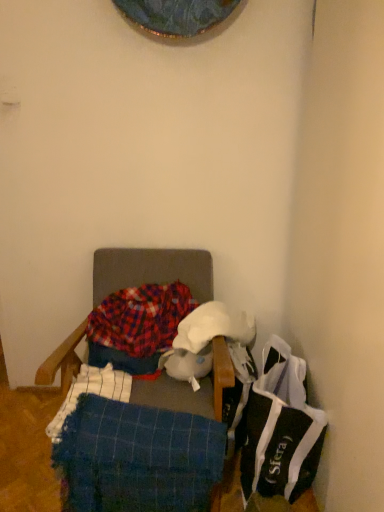
Question: Visually, is blue woven blanket at lower left, which is the first blanket from bottom to top, positioned to the left or to the right of plaid fabric chair at center?

Choices:
 (A) left
 (B) right

Answer: (B)

Question: From the image's perspective, is blue woven blanket at lower left, positioned as the 1th blanket in front-to-back order, located above or below plaid fabric chair at center?

Choices:
 (A) below
 (B) above

Answer: (A)

Question: Which object is positioned closest to the plaid fabric blanket at center, acting as the 1th blanket starting from the back?

Choices:
 (A) plaid fabric chair at center
 (B) blue woven blanket at lower left, arranged as the 2th blanket when viewed from the top
 (C) black fabric bag at lower right

Answer: (A)

Question: Considering the real-world distances, which object is closest to the plaid fabric chair at center?

Choices:
 (A) blue woven blanket at lower left, positioned as the 1th blanket in front-to-back order
 (B) plaid fabric blanket at center, the 1th blanket from the top
 (C) black fabric bag at lower right

Answer: (B)